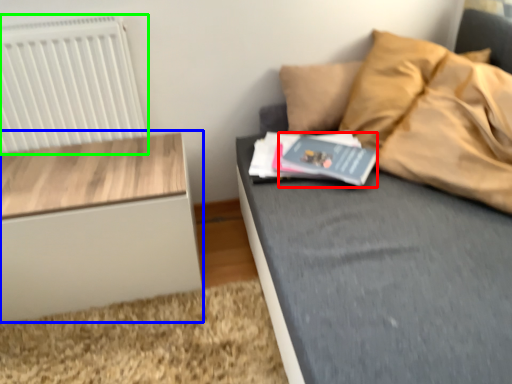
Question: Estimate the real-world distances between objects in this image. Which object is closer to paperback book (highlighted by a red box), nightstand (highlighted by a blue box) or radiator (highlighted by a green box)?

Choices:
 (A) nightstand
 (B) radiator

Answer: (A)